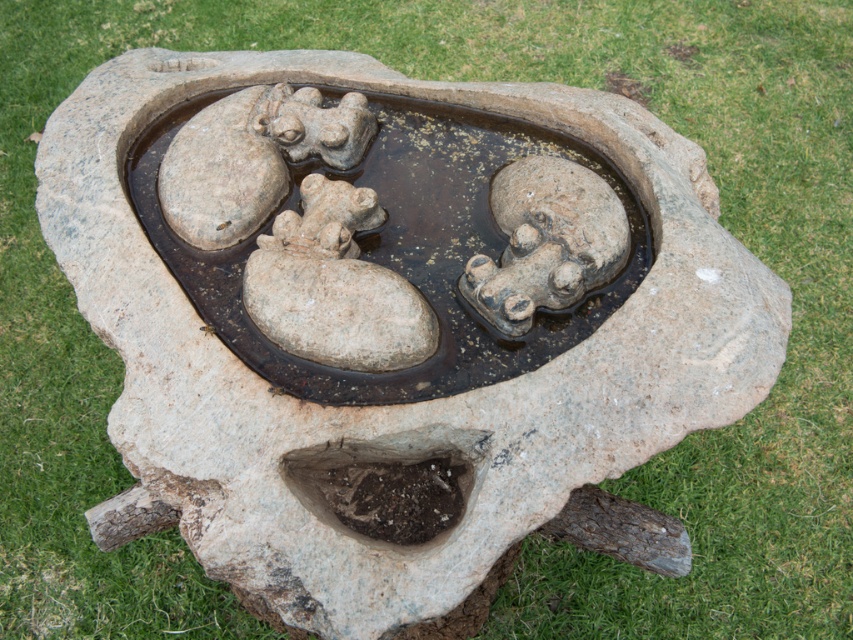
You are standing at the edge of the stone structure and want to locate the rough stone frog at center. What are the coordinates where you should look?

The rough stone frog at center is located at coordinates point (546, 241).

You are standing in front of the stone structure and want to place a small decorative item between the rough stone frog at center and the smooth stone frog at center. Based on their positions, where should you place the item so it is visible from your current viewpoint?

Since the rough stone frog at center is in front of the smooth stone frog at center, you should place the item between them but closer to the rough stone frog at center to ensure it remains visible from your current viewpoint.